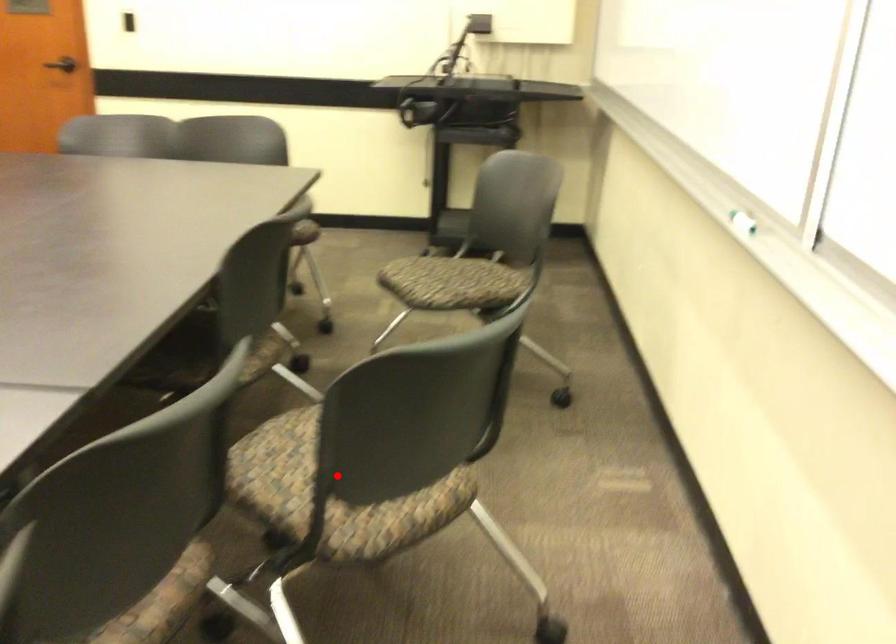
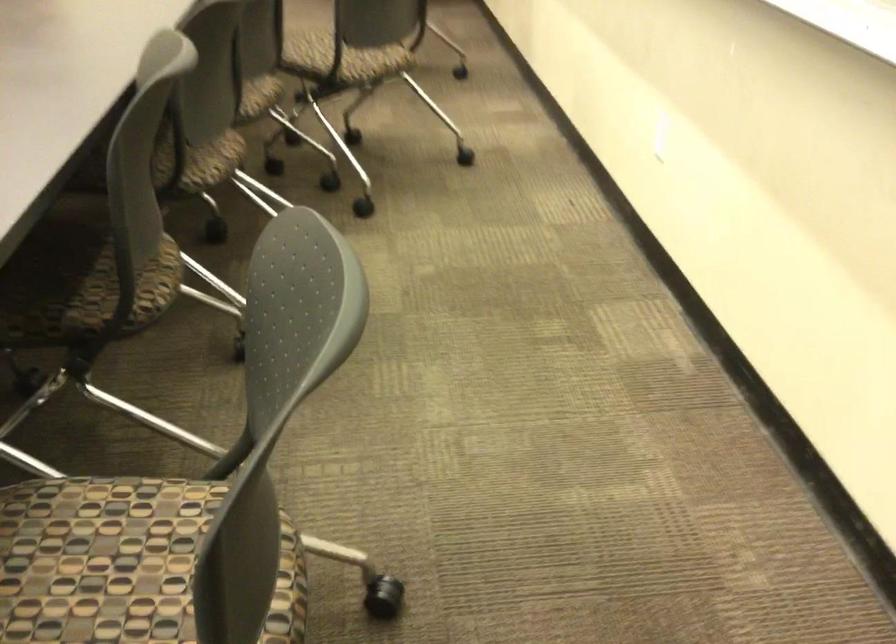
Locate, in the second image, the point that corresponds to the highlighted location in the first image.

(337, 57)